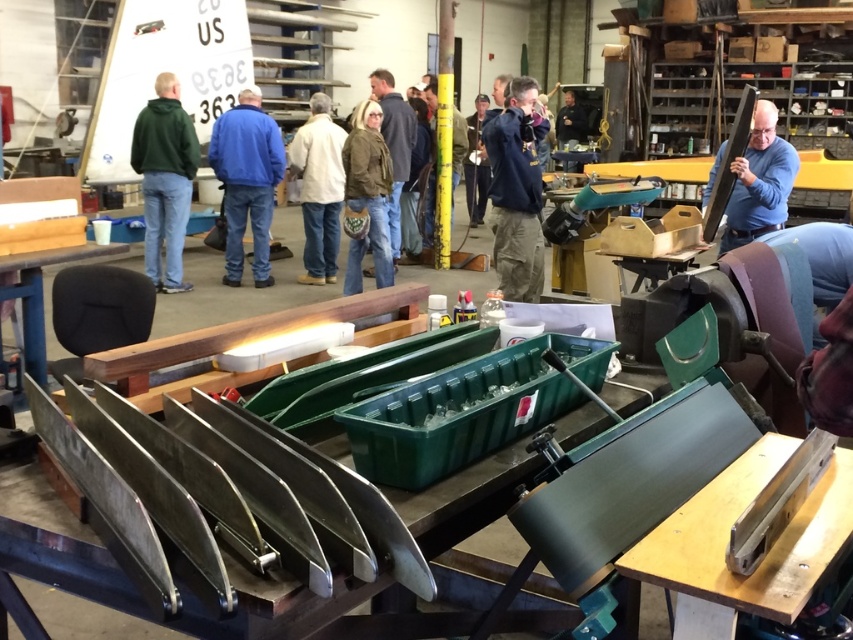
You are a new worker entering the workshop and need to find a spot to place your tool kit. You see the green matte hoodie at left and the white matte jacket at center. Which person has more space around them to safely place your toolkit without disturbing them?

The white matte jacket at center has more space around them because the green matte hoodie at left occupies less space, meaning the white matte jacket at center is surrounded by more available area to place the toolkit safely.

Based on the photo, you are a tailor in the workshop and need to determine which jacket, the dark blue jacket at center or the white matte jacket at center, would be more suitable to wear over a thick sweater. Based on their thickness, which one would you recommend?

The dark blue jacket at center is thinner than the white matte jacket at center, so the dark blue jacket at center would be more suitable to wear over a thick sweater as it is less bulky.